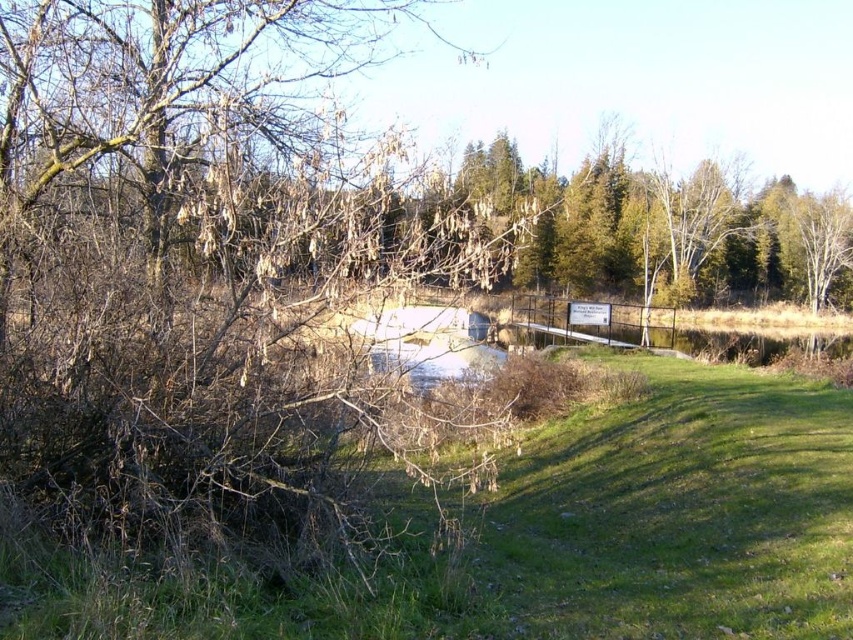
Question: Does brown/dried wood at left appear on the left side of green grass at lower right?

Choices:
 (A) yes
 (B) no

Answer: (A)

Question: Which point appears closest to the camera in this image?

Choices:
 (A) (74, 362)
 (B) (624, 198)

Answer: (A)

Question: Does brown/dried wood at left have a lesser width compared to green grass at lower right?

Choices:
 (A) no
 (B) yes

Answer: (B)

Question: Is brown/dried wood at left positioned in front of green textured tree at upper center?

Choices:
 (A) yes
 (B) no

Answer: (A)

Question: Among these points, which one is nearest to the camera?

Choices:
 (A) (515, 273)
 (B) (683, 433)

Answer: (B)

Question: Which object appears closest to the camera in this image?

Choices:
 (A) brown/dried wood at left
 (B) green textured tree at upper center
 (C) green grass at lower right

Answer: (C)